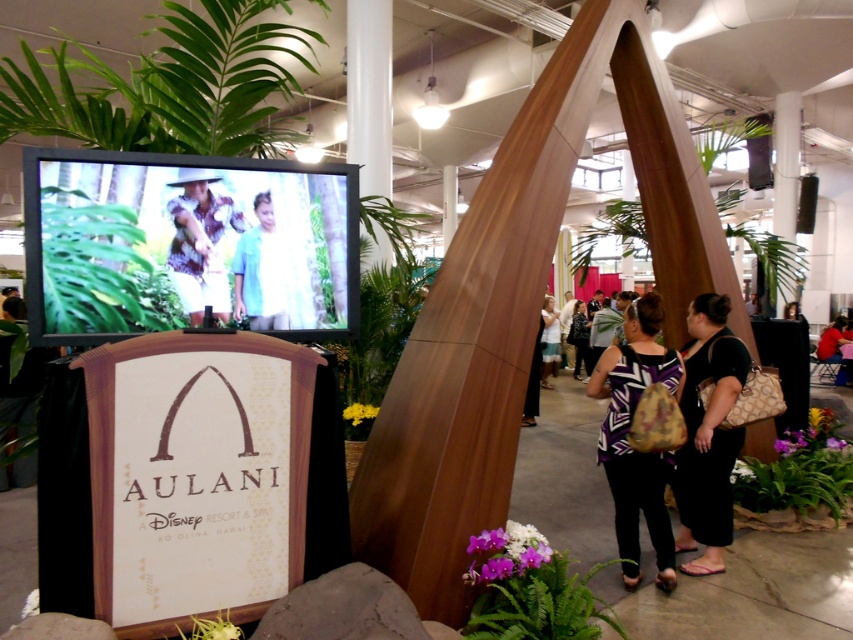
Question: Which point is closer to the camera?

Choices:
 (A) (795, 272)
 (B) (532, 355)

Answer: (B)

Question: Estimate the real-world distances between objects in this image. Which object is closer to the dark gray fabric dress at center?

Choices:
 (A) light blue denim shorts at center
 (B) green leafy plant at upper center
 (C) black fabric dress at center
 (D) light blue shirt at center

Answer: (A)

Question: Which of the following is the closest to the observer?

Choices:
 (A) red shirt at right
 (B) patterned fabric dress at center
 (C) light blue denim shorts at center
 (D) green leafy plant at lower right

Answer: (B)

Question: Is light blue shirt at center smaller than light blue denim shorts at center?

Choices:
 (A) yes
 (B) no

Answer: (A)

Question: Is purple glossy orchid at lower center positioned in front of green leafy plant at lower right?

Choices:
 (A) yes
 (B) no

Answer: (A)

Question: Can you confirm if black fabric dress at center is wider than green leafy plant at upper center?

Choices:
 (A) no
 (B) yes

Answer: (B)